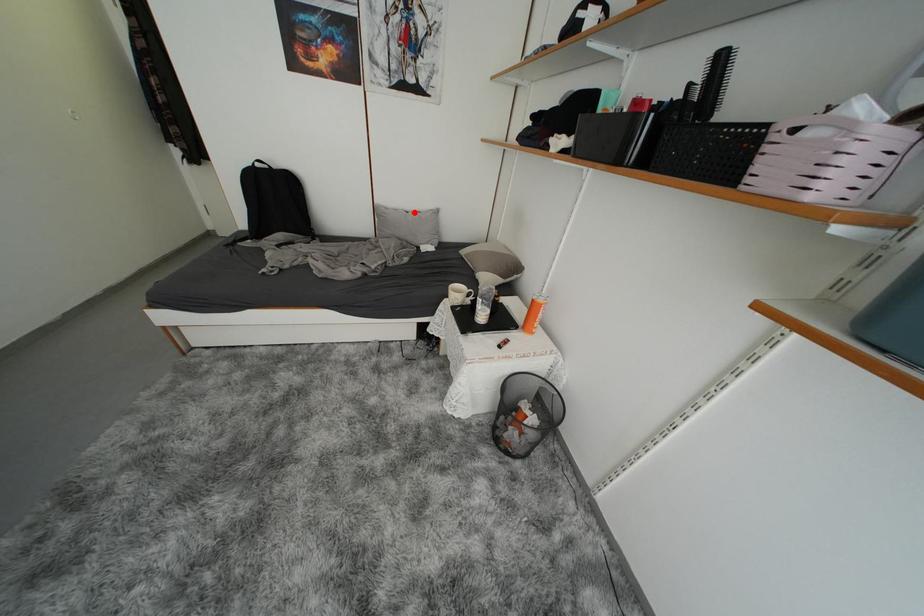
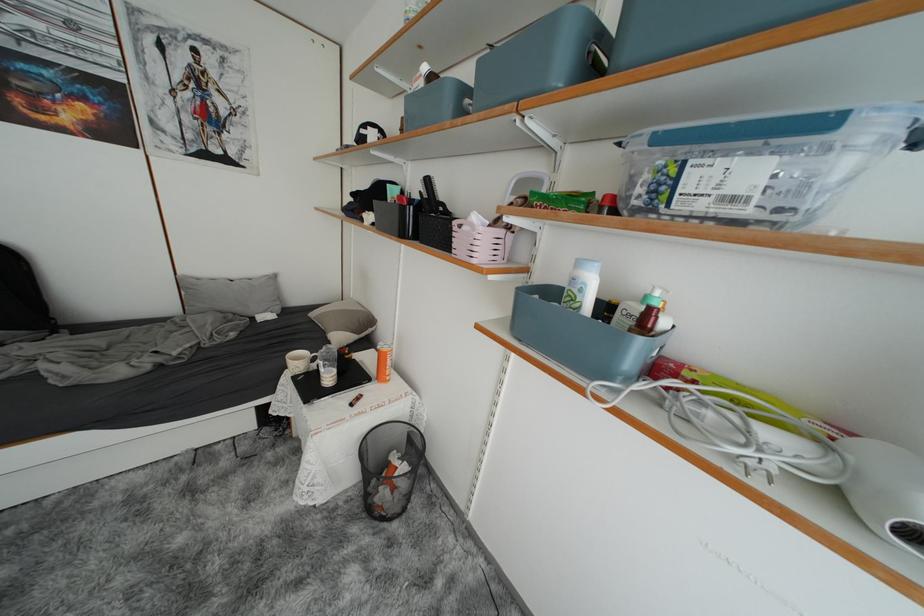
Question: I am providing you with two images of the same scene from different viewpoints. Image1 has a red point marked. In image2, the corresponding 3D location appears at what relative position? Reply with the corresponding letter.

Choices:
 (A) Closer
 (B) Farther

Answer: (B)